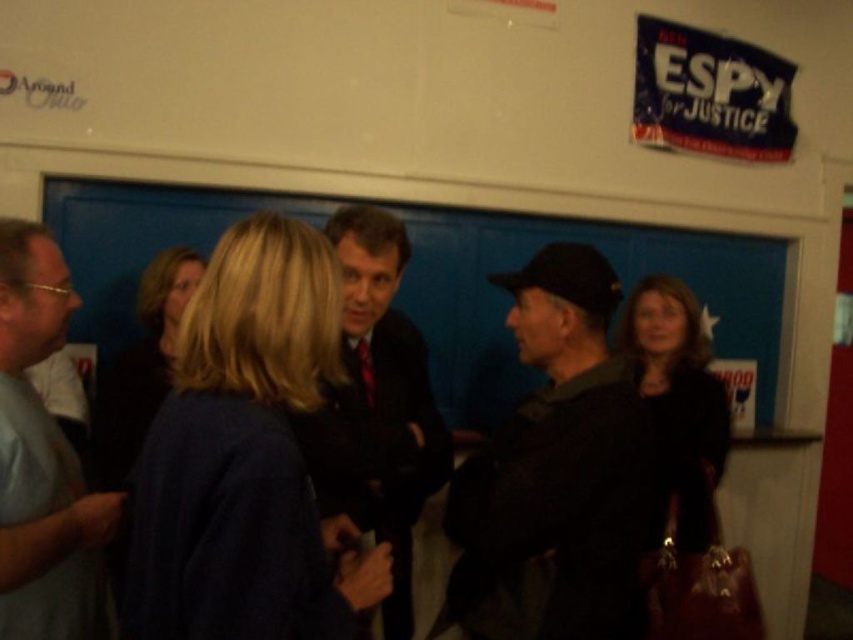
Question: Among these objects, which one is nearest to the camera?

Choices:
 (A) gray t-shirt at left
 (B) dark suit jacket at center
 (C) blonde hair at center

Answer: (A)

Question: Which object is positioned closest to the matte black jacket at right?

Choices:
 (A) dark gray fabric jacket at center
 (B) blonde hair at center

Answer: (A)

Question: Is dark gray fabric jacket at center positioned before matte black jacket at right?

Choices:
 (A) yes
 (B) no

Answer: (A)

Question: Which object is farther from the camera taking this photo?

Choices:
 (A) blonde hair at center
 (B) dark suit jacket at center
 (C) gray t-shirt at left

Answer: (A)

Question: Does gray t-shirt at left come in front of blonde hair at center?

Choices:
 (A) yes
 (B) no

Answer: (A)

Question: Can you confirm if dark suit jacket at center is thinner than matte black jacket at right?

Choices:
 (A) yes
 (B) no

Answer: (A)